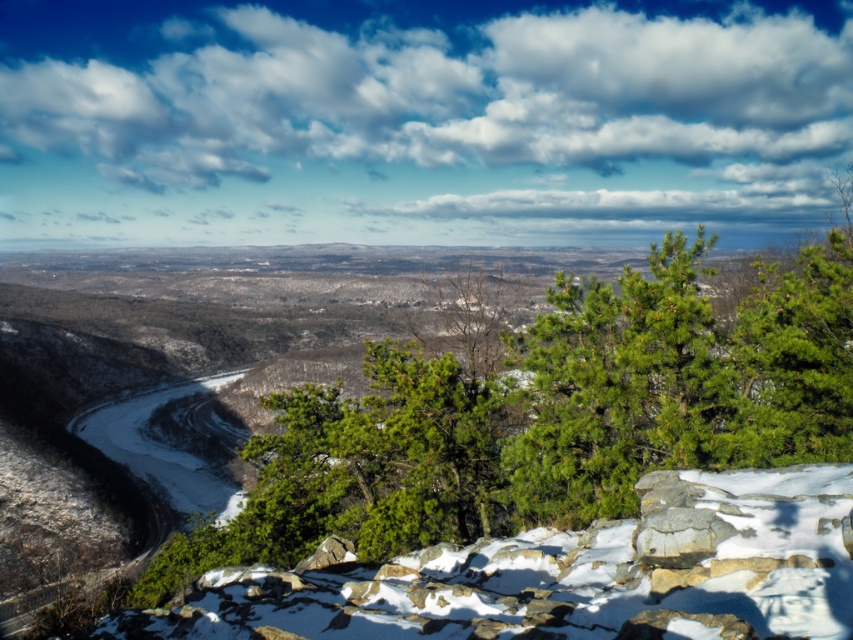
Question: Can you confirm if green needle-like at center is thinner than white powdery snow at center?

Choices:
 (A) no
 (B) yes

Answer: (A)

Question: Which point is closer to the camera?

Choices:
 (A) green needle-like at center
 (B) white powdery snow at center

Answer: (B)

Question: Which of the following is the farthest from the observer?

Choices:
 (A) (703, 364)
 (B) (236, 572)

Answer: (B)

Question: Is green needle-like at center above white powdery snow at center?

Choices:
 (A) no
 (B) yes

Answer: (A)

Question: Is green needle-like at center smaller than white powdery snow at center?

Choices:
 (A) yes
 (B) no

Answer: (B)